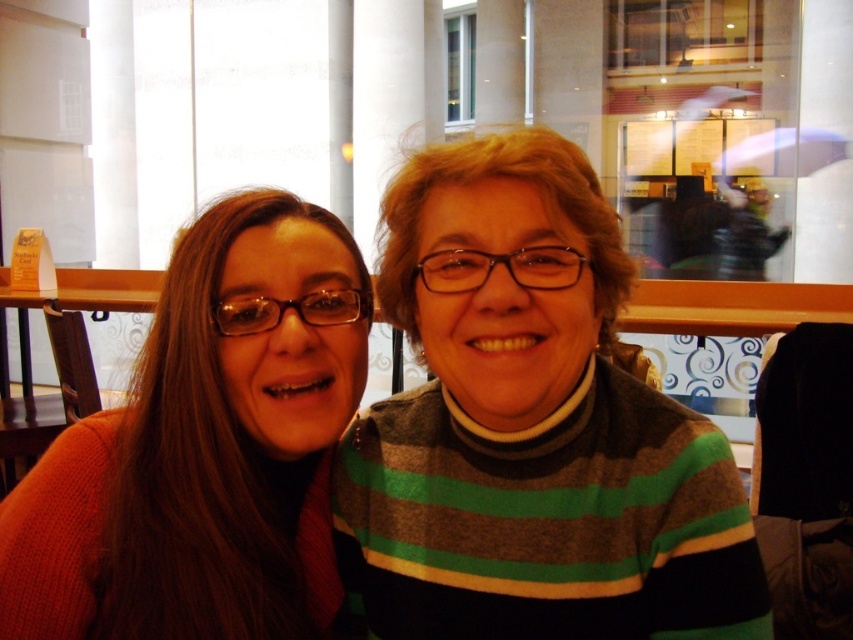
Consider the image. You are a fashion designer observing the scene. You need to determine the spatial relationship between the striped sweater at center and the knitted orange sweater at left. Which one is positioned higher in the image?

The striped sweater at center is above knitted orange sweater at left, so the striped sweater at center is positioned higher.

You are a fashion designer observing two sweaters in the image. The striped sweater at center and the knitted orange sweater at left. Which one is positioned to the right side of the other?

The striped sweater at center is positioned to the right of the knitted orange sweater at left.